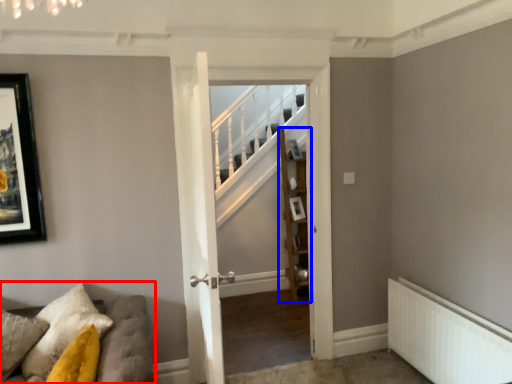
Question: Which object is further to the camera taking this photo, furniture (highlighted by a red box) or shelf (highlighted by a blue box)?

Choices:
 (A) furniture
 (B) shelf

Answer: (B)